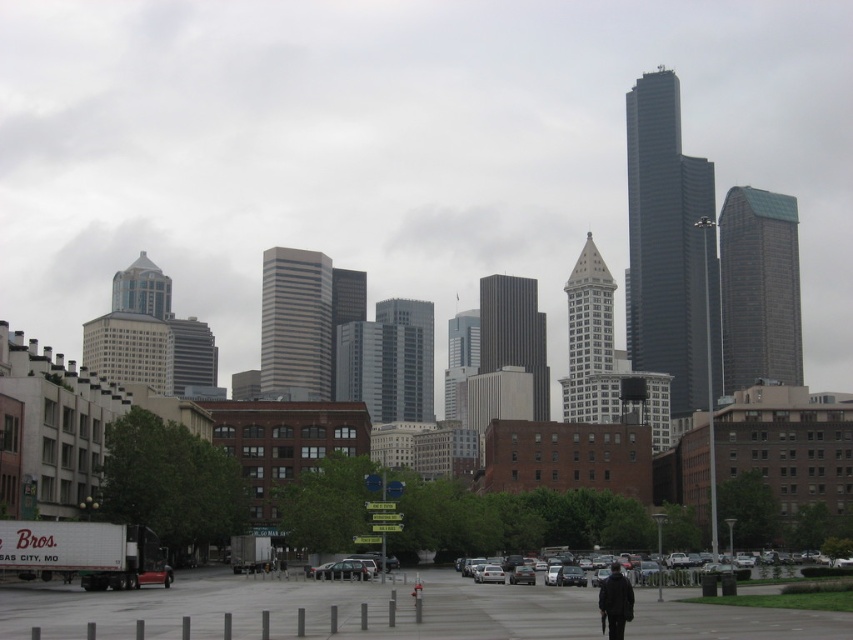
Does gray concrete pavement at center lie behind silver metallic sedan at center?

That is False.

Does point (189, 579) come in front of point (554, 563)?

Yes, point (189, 579) is in front of point (554, 563).

I want to click on gray concrete pavement at center, so click(305, 609).

Between point (796, 572) and point (358, 563), which one is positioned behind?

The point (796, 572) is more distant.

Is silver metallic sedan at center positioned behind metallic silver sedan at center?

No, silver metallic sedan at center is in front of metallic silver sedan at center.

Who is more forward, (744, 568) or (347, 566)?

Point (347, 566) is more forward.

The width and height of the screenshot is (853, 640). Find the location of `silver metallic sedan at center`. silver metallic sedan at center is located at coordinates tap(788, 572).

Is silver metallic sedan at center closer to the viewer compared to dark blue jacket at center?

No, it is behind dark blue jacket at center.

Is silver metallic sedan at center further to the viewer compared to dark blue jacket at center?

Yes, it is.

Is point (653, 561) in front of point (614, 576)?

No, it is not.

At what (x,y) coordinates should I click in order to perform the action: click on silver metallic sedan at center. Please return your answer as a coordinate pair (x, y). This screenshot has width=853, height=640. Looking at the image, I should click on (788, 572).